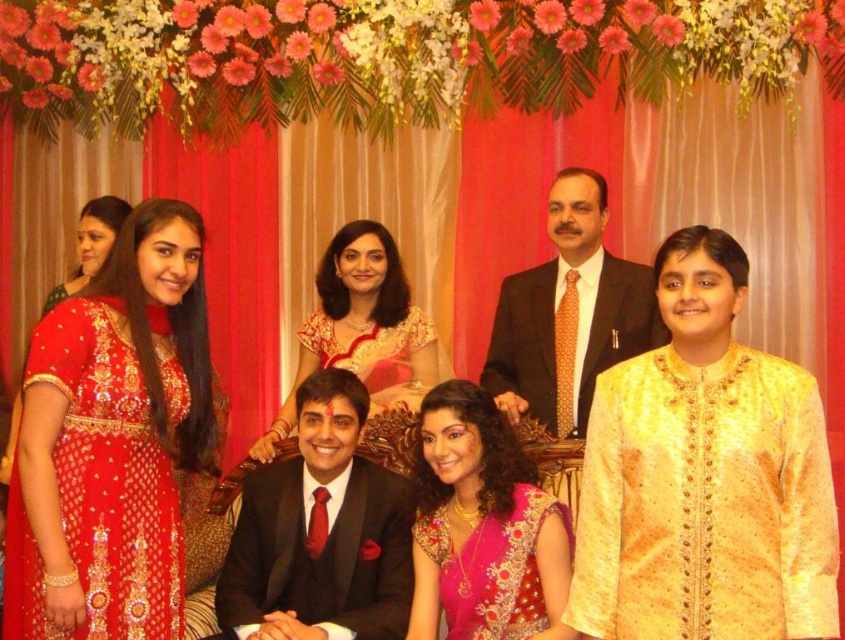
Who is taller, matte gold saree at center or matte gold kurta at center?

matte gold kurta at center

Looking at this image, is matte gold saree at center to the left of matte gold kurta at center from the viewer's perspective?

Yes, matte gold saree at center is to the left of matte gold kurta at center.

Which is in front, point (328, 337) or point (581, 212)?

Point (581, 212) is in front.

This screenshot has width=845, height=640. I want to click on matte gold saree at center, so click(363, 330).

Is the position of matte gold kurta at center less distant than that of matte red dress at upper left?

A: Yes, matte gold kurta at center is closer to the viewer.

Which is in front, point (601, 196) or point (95, 262)?

Point (601, 196) is in front.

You are a GUI agent. You are given a task and a screenshot of the screen. Output one action in this format:
    pyautogui.click(x=<x>, y=<y>)
    Task: Click on the matte gold kurta at center
    This screenshot has height=640, width=845.
    Given the screenshot: What is the action you would take?
    576,214

Does pink embroidered saree at center have a greater height compared to matte red dress at upper left?

Indeed, pink embroidered saree at center has a greater height compared to matte red dress at upper left.

You are a GUI agent. You are given a task and a screenshot of the screen. Output one action in this format:
    pyautogui.click(x=<x>, y=<y>)
    Task: Click on the pink embroidered saree at center
    
    Given the screenshot: What is the action you would take?
    pyautogui.click(x=483, y=528)

Does point (432, 515) lie in front of point (66, 284)?

That is True.

Find the location of a particular element. pink embroidered saree at center is located at coordinates (483, 528).